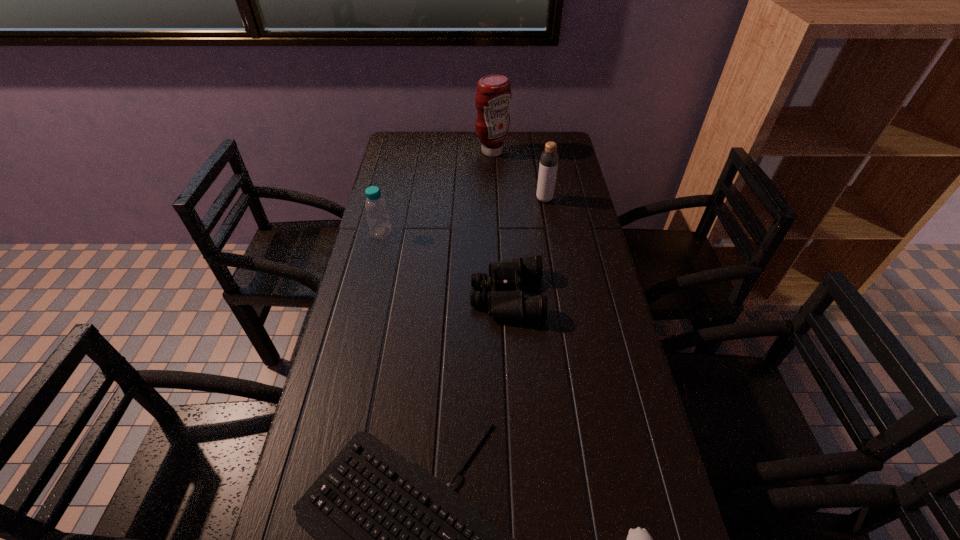
Find the location of a particular element. free spot located 0.090m on the back of the second nearest bottle is located at coordinates (387, 208).

Where is `vacant space located 0.090m through the eyepieces of the third shortest object`? The height and width of the screenshot is (540, 960). vacant space located 0.090m through the eyepieces of the third shortest object is located at coordinates (439, 295).

What are the coordinates of `vacant area situated through the eyepieces of the third shortest object` in the screenshot? It's located at (411, 295).

The image size is (960, 540). Identify the location of vacant space located 0.190m through the eyepieces of the third shortest object. click(403, 295).

Image resolution: width=960 pixels, height=540 pixels. I want to click on object that is positioned at the far edge, so click(493, 96).

Find the location of a particular element. object present at the left edge is located at coordinates (376, 210).

At what (x,y) coordinates should I click in order to perform the action: click on object present at the right edge. Please return your answer as a coordinate pair (x, y). The height and width of the screenshot is (540, 960). Looking at the image, I should click on click(x=549, y=158).

Find the location of a particular element. This screenshot has height=540, width=960. vacant space at the left edge of the desktop is located at coordinates (383, 251).

Locate an element on the screen. The width and height of the screenshot is (960, 540). vacant space at the right edge of the desktop is located at coordinates (598, 280).

Where is `free region at the far right corner of the desktop`? Image resolution: width=960 pixels, height=540 pixels. free region at the far right corner of the desktop is located at coordinates (538, 161).